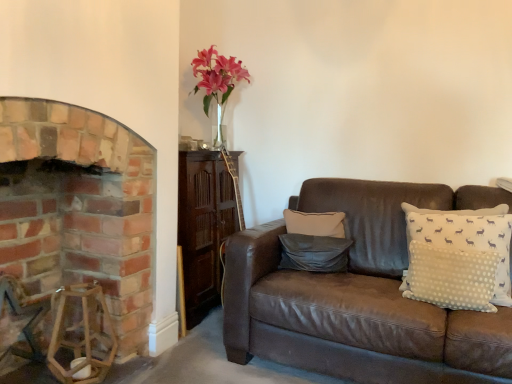
Question: Is brick fireplace at left wider or thinner than pink glass vase at upper center?

Choices:
 (A) wide
 (B) thin

Answer: (A)

Question: In the image, is brick fireplace at left on the left side or the right side of pink glass vase at upper center?

Choices:
 (A) left
 (B) right

Answer: (A)

Question: Estimate the real-world distances between objects in this image. Which object is farther from the dark gray leather pillow at center, which appears as the 2th pillow when viewed from the right?

Choices:
 (A) white dotted pillow at right, which is counted as the second pillow, starting from the left
 (B) pink glass vase at upper center
 (C) brick fireplace at left

Answer: (B)

Question: Based on their relative distances, which object is farther from the white dotted pillow at right, which is counted as the second pillow, starting from the left?

Choices:
 (A) pink glass vase at upper center
 (B) brick fireplace at left
 (C) dark gray leather pillow at center, which is the 1th pillow in left-to-right order

Answer: (A)